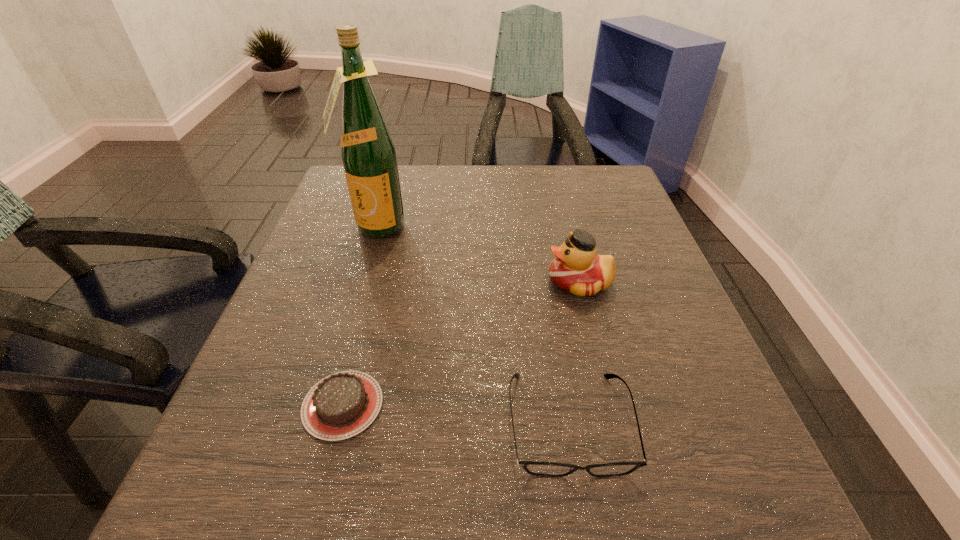
Where is `vacant space that satisfies the following two spatial constraints: 1. on the front-facing side of the tallest object; 2. on the left side of the shortest object`? The width and height of the screenshot is (960, 540). vacant space that satisfies the following two spatial constraints: 1. on the front-facing side of the tallest object; 2. on the left side of the shortest object is located at coordinates (322, 405).

The width and height of the screenshot is (960, 540). Find the location of `blank space that satisfies the following two spatial constraints: 1. on the face of the duck; 2. on the front-facing side of the third tallest object`. blank space that satisfies the following two spatial constraints: 1. on the face of the duck; 2. on the front-facing side of the third tallest object is located at coordinates (614, 423).